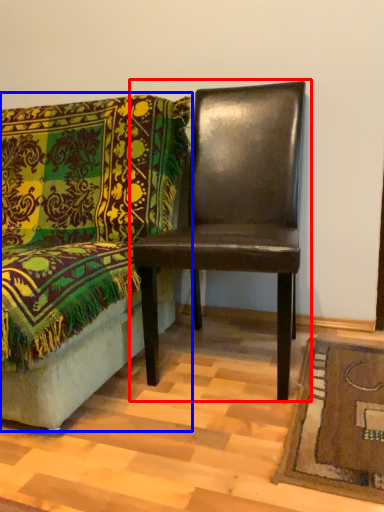
Question: Which point is closer to the camera, chair (highlighted by a red box) or chair (highlighted by a blue box)?

Choices:
 (A) chair
 (B) chair

Answer: (B)